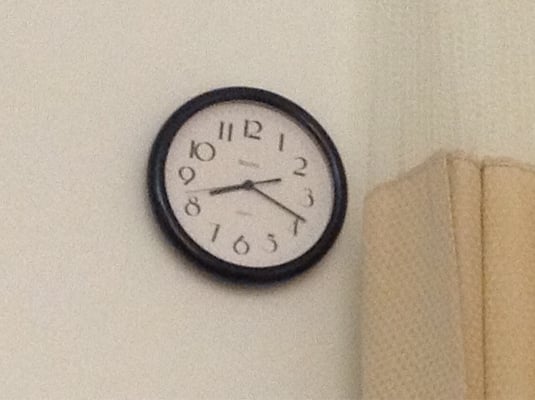
Find the location of `wall`. wall is located at coordinates (48, 132).